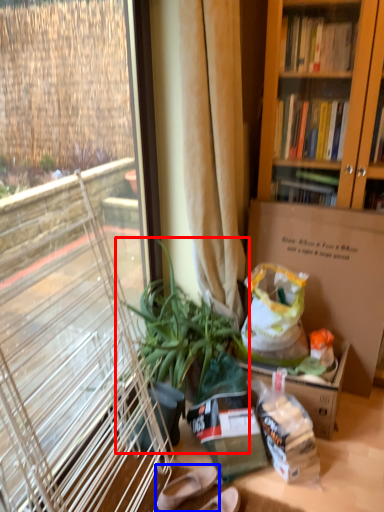
Question: Which point is further to the camera, houseplant (highlighted by a red box) or footwear (highlighted by a blue box)?

Choices:
 (A) houseplant
 (B) footwear

Answer: (B)